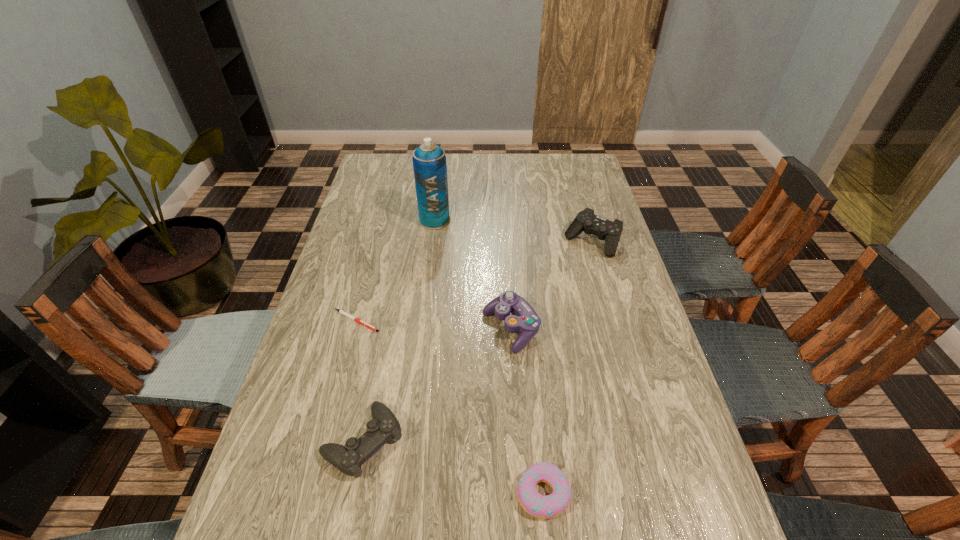
Find the location of a particular element. The image size is (960, 540). vacant space that's between the farthest control and the fourth tallest object is located at coordinates (478, 341).

Locate which object is the fourth closest to the fifth tallest object. Please provide its 2D coordinates. Your answer should be formatted as a tuple, i.e. [(x, y)], where the tuple contains the x and y coordinates of a point satisfying the conditions above.

[(586, 220)]

Where is `object that stands as the fifth closest to the pen`? object that stands as the fifth closest to the pen is located at coordinates [586, 220].

Select which control appears as the closest to the second control from right to left. Please provide its 2D coordinates. Your answer should be formatted as a tuple, i.e. [(x, y)], where the tuple contains the x and y coordinates of a point satisfying the conditions above.

[(348, 459)]

The width and height of the screenshot is (960, 540). In order to click on control that can be found as the closest to the farthest control in this screenshot , I will do `click(524, 319)`.

Where is `free spot that satisfies the following two spatial constraints: 1. on the front side of the farthest control; 2. on the right side of the aerosol can`? The width and height of the screenshot is (960, 540). free spot that satisfies the following two spatial constraints: 1. on the front side of the farthest control; 2. on the right side of the aerosol can is located at coordinates (432, 242).

At what (x,y) coordinates should I click in order to perform the action: click on free spot that satisfies the following two spatial constraints: 1. on the clicker of the second farthest control; 2. on the right side of the pen. Please return your answer as a coordinate pair (x, y). Looking at the image, I should click on (354, 329).

Locate an element on the screen. vacant position in the image that satisfies the following two spatial constraints: 1. on the clicker of the pen; 2. on the back side of the second control from right to left is located at coordinates (354, 329).